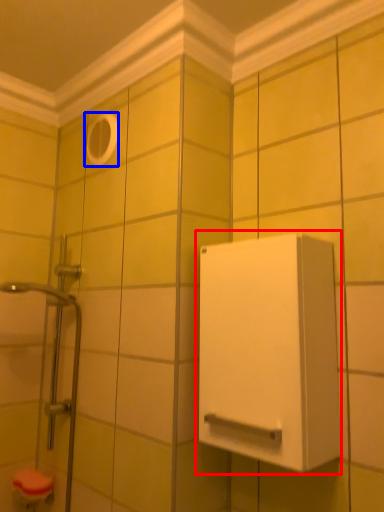
Question: Which point is further to the camera, medicine cabinet (highlighted by a red box) or hole (highlighted by a blue box)?

Choices:
 (A) medicine cabinet
 (B) hole

Answer: (B)